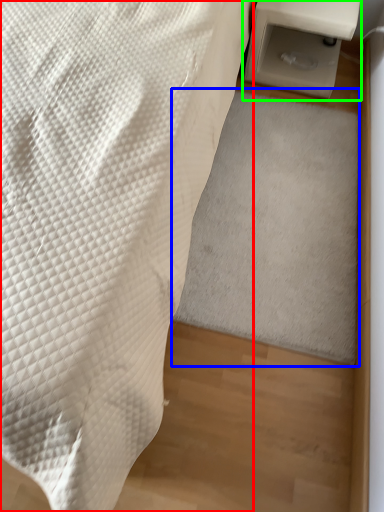
Question: Based on their relative distances, which object is nearer to furniture (highlighted by a red box)? Choose from mat (highlighted by a blue box) and table (highlighted by a green box).

Choices:
 (A) mat
 (B) table

Answer: (A)